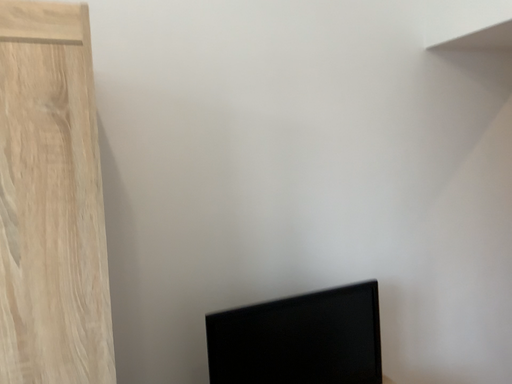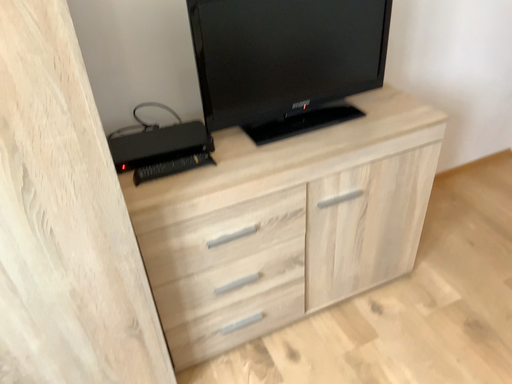
Question: How did the camera likely rotate when shooting the video?

Choices:
 (A) rotated downward
 (B) rotated upward

Answer: (A)